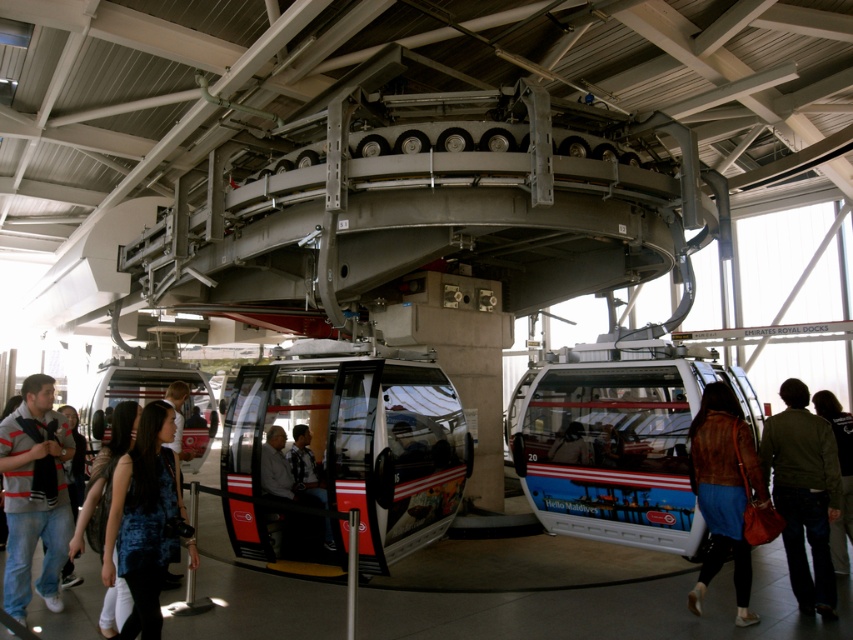
You are standing at the entrance of the modern cable car station and see the point marked at coordinates (105,467). What object is located at that point?

The point at coordinates (105,467) corresponds to the blue denim jeans at lower left.